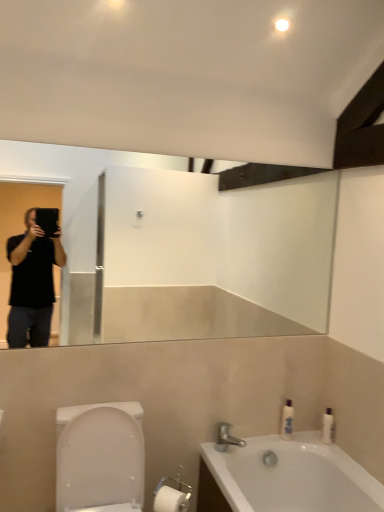
Question: Does white glossy bathtub at lower right have a lesser width compared to silver metallic faucet at lower center?

Choices:
 (A) no
 (B) yes

Answer: (A)

Question: Can you confirm if white glossy bathtub at lower right is smaller than silver metallic faucet at lower center?

Choices:
 (A) no
 (B) yes

Answer: (A)

Question: From the image's perspective, is white glossy bathtub at lower right under silver metallic faucet at lower center?

Choices:
 (A) yes
 (B) no

Answer: (A)

Question: Is white glossy bathtub at lower right at the right side of silver metallic faucet at lower center?

Choices:
 (A) yes
 (B) no

Answer: (A)

Question: Can you confirm if white glossy bathtub at lower right is shorter than silver metallic faucet at lower center?

Choices:
 (A) yes
 (B) no

Answer: (B)

Question: Is white glossy bottle at right, arranged as the 2th toiletry when viewed from the right, to the left or to the right of silver metallic faucet at lower center in the image?

Choices:
 (A) right
 (B) left

Answer: (A)

Question: From the image's perspective, relative to silver metallic faucet at lower center, is white glossy bottle at right, arranged as the 2th toiletry when viewed from the right, above or below?

Choices:
 (A) below
 (B) above

Answer: (B)

Question: Relative to silver metallic faucet at lower center, is white glossy bottle at right, arranged as the 2th toiletry when viewed from the right, in front or behind?

Choices:
 (A) behind
 (B) front

Answer: (A)

Question: Is white glossy bottle at right, which is counted as the first toiletry, starting from the left, wider or thinner than silver metallic faucet at lower center?

Choices:
 (A) wide
 (B) thin

Answer: (B)

Question: In terms of width, does white glossy bottle at right, arranged as the 2th toiletry when viewed from the right, look wider or thinner when compared to white glossy bottle at right, the 1th toiletry when ordered from right to left?

Choices:
 (A) thin
 (B) wide

Answer: (B)

Question: In terms of size, does white glossy bottle at right, which is counted as the first toiletry, starting from the left, appear bigger or smaller than white glossy bottle at right, arranged as the second toiletry when viewed from the left?

Choices:
 (A) big
 (B) small

Answer: (A)

Question: Is white glossy bottle at right, which is counted as the first toiletry, starting from the left, in front of or behind white glossy bottle at right, arranged as the second toiletry when viewed from the left, in the image?

Choices:
 (A) behind
 (B) front

Answer: (A)

Question: Which is correct: white glossy bottle at right, arranged as the 2th toiletry when viewed from the right, is inside white glossy bottle at right, arranged as the second toiletry when viewed from the left, or outside of it?

Choices:
 (A) outside
 (B) inside

Answer: (A)

Question: In the image, is silver metallic faucet at lower center positioned in front of or behind white glossy bathtub at lower right?

Choices:
 (A) behind
 (B) front

Answer: (A)

Question: In terms of height, does silver metallic faucet at lower center look taller or shorter compared to white glossy bathtub at lower right?

Choices:
 (A) tall
 (B) short

Answer: (B)